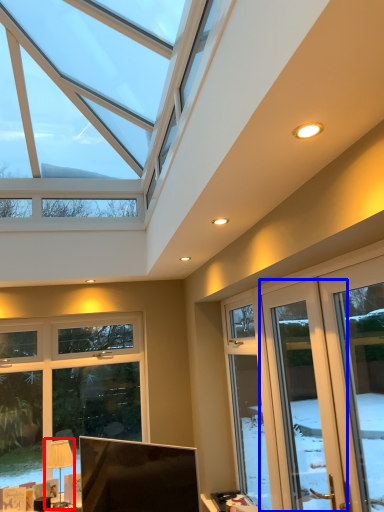
Question: Among these objects, which one is farthest to the camera, table lamp (highlighted by a red box) or screen door (highlighted by a blue box)?

Choices:
 (A) table lamp
 (B) screen door

Answer: (A)